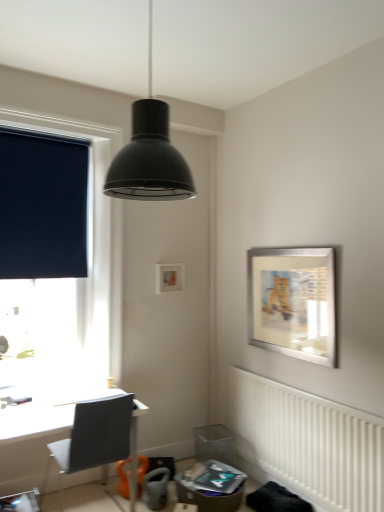
Question: In terms of height, does dark blue fabric at left look taller or shorter compared to white textured radiator at lower right?

Choices:
 (A) short
 (B) tall

Answer: (B)

Question: Looking at the image, does dark blue fabric at left seem bigger or smaller compared to white textured radiator at lower right?

Choices:
 (A) small
 (B) big

Answer: (A)

Question: Which is nearer to the dark blue roller blind at left?

Choices:
 (A) silver metallic picture frame at upper right
 (B) gray fabric chair at lower left
 (C) dark blue fabric at left
 (D) white textured radiator at lower right
 (E) matte black pendant light at upper center

Answer: (C)

Question: Which is nearer to the dark blue fabric at left?

Choices:
 (A) white textured radiator at lower right
 (B) matte black pendant light at upper center
 (C) silver metallic picture frame at upper right
 (D) dark blue roller blind at left
 (E) gray fabric chair at lower left

Answer: (D)